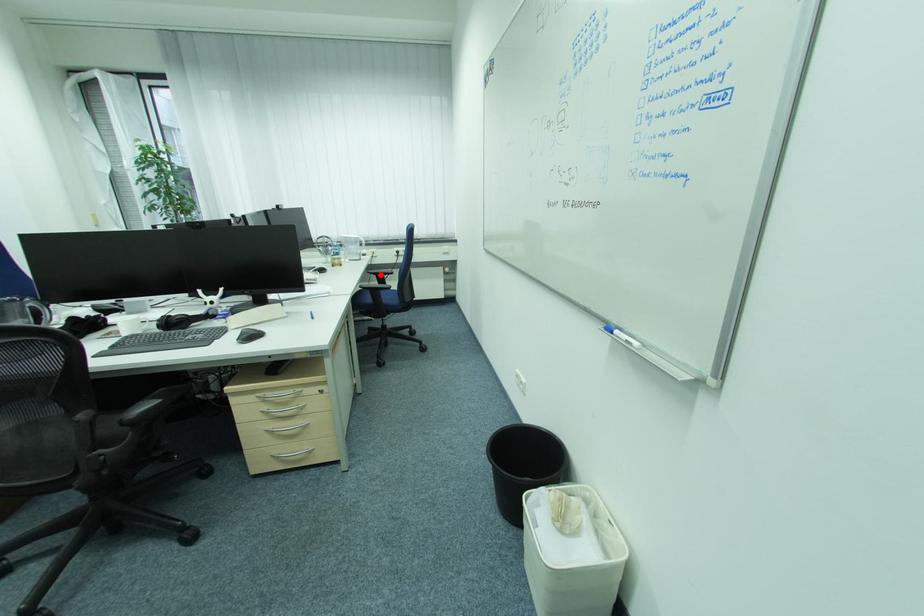
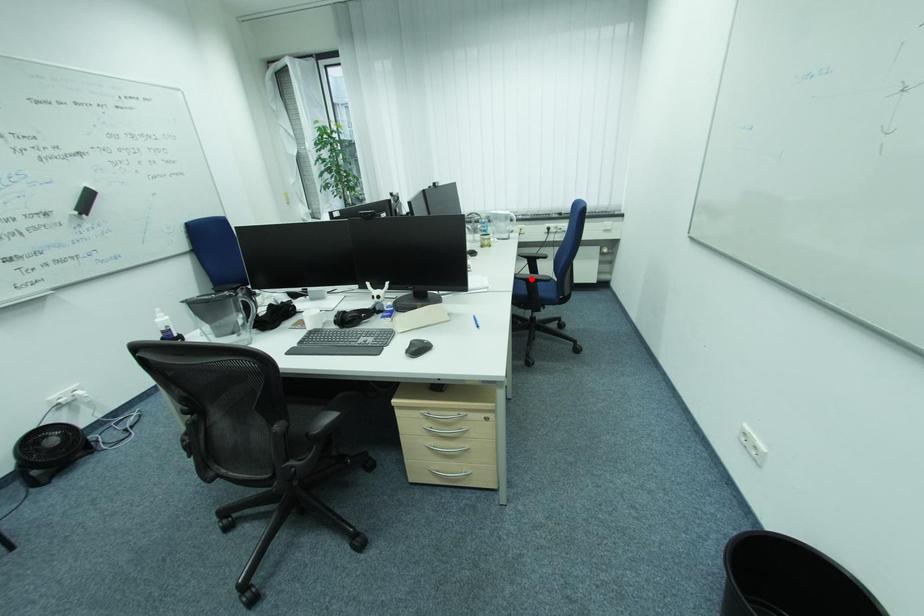
I am providing you with two images of the same scene from different viewpoints. A red point is marked on the first image and another point is marked on the second image. Does the point marked in image1 correspond to the same location as the one in image2?

No